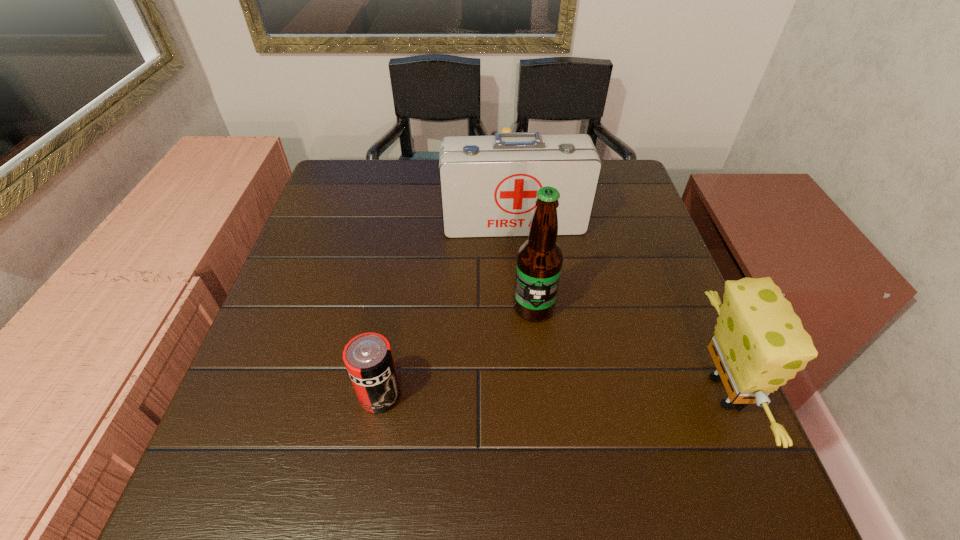
Locate an element on the screen. This screenshot has width=960, height=540. free space on the desktop that is between the leftmost object and the sponge and is positioned on the front-facing side of the first-aid kit is located at coordinates (539, 394).

Find the location of a particular element. Image resolution: width=960 pixels, height=540 pixels. vacant space on the desktop that is between the leftmost object and the sponge and is positioned on the face of the Lego is located at coordinates (581, 393).

Locate an element on the screen. Image resolution: width=960 pixels, height=540 pixels. vacant space on the desktop that is between the fourth tallest object and the sponge and is positioned on the label of the tallest object is located at coordinates (513, 394).